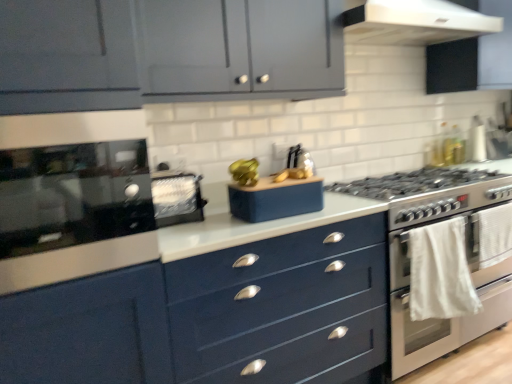
At what (x,y) coordinates should I click in order to perform the action: click on empty space that is to the right of matte blue speaker at center, marked as the 2th appliance in a left-to-right arrangement. Please return your answer as a coordinate pair (x, y). Looking at the image, I should click on (332, 203).